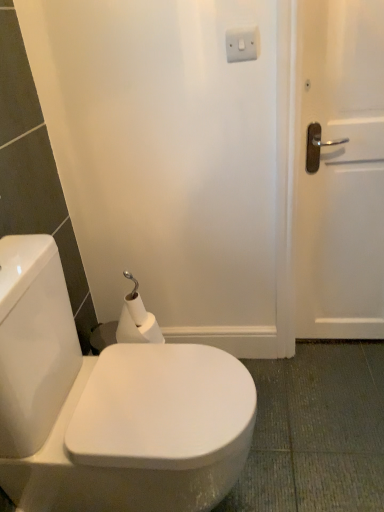
Question: In terms of width, does white matte toilet paper at lower left look wider or thinner when compared to white glossy toilet at center?

Choices:
 (A) thin
 (B) wide

Answer: (A)

Question: From a real-world perspective, is white matte toilet paper at lower left above or below white glossy toilet at center?

Choices:
 (A) below
 (B) above

Answer: (B)

Question: Which is farther from the white plastic switch at upper center?

Choices:
 (A) white matte toilet paper at lower left
 (B) white glossy toilet at center

Answer: (B)

Question: Estimate the real-world distances between objects in this image. Which object is farther from the white matte toilet paper at lower left?

Choices:
 (A) white glossy toilet at center
 (B) white plastic switch at upper center

Answer: (B)